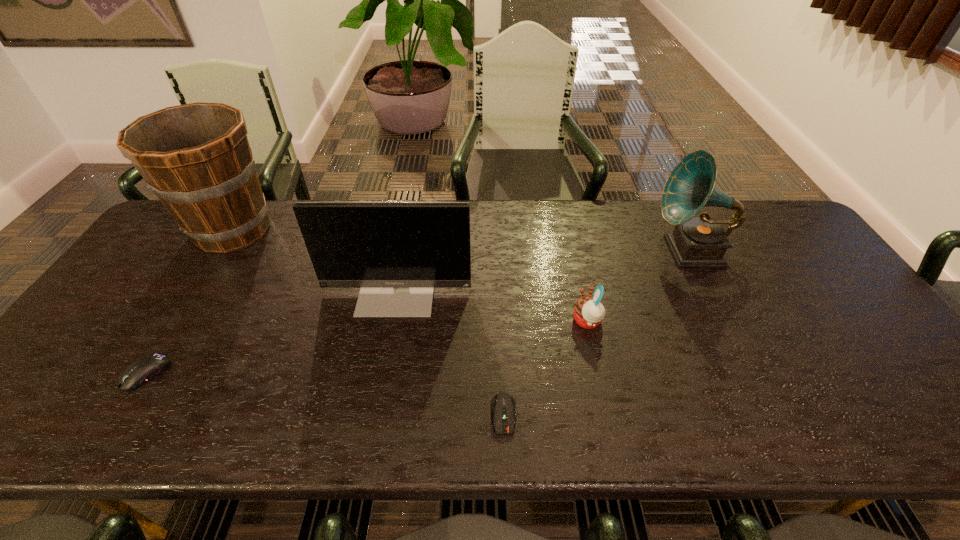
Identify the location of free space between the third object from left to right and the farther computer equipment. 272,332.

Where is `free space between the nearest object and the fifth object from left to right`? free space between the nearest object and the fifth object from left to right is located at coordinates (545, 368).

What are the coordinates of `vacant area that lies between the right computer equipment and the phonograph_record` in the screenshot? It's located at (597, 333).

Find the location of a particular element. This screenshot has height=540, width=960. vacant space in between the bucket and the fifth farthest object is located at coordinates (189, 301).

Identify the location of free space between the nearer computer equipment and the third object from left to right. (450, 352).

The width and height of the screenshot is (960, 540). I want to click on vacant point located between the rightmost object and the second object from right to left, so click(x=638, y=286).

The height and width of the screenshot is (540, 960). In order to click on the closest object relative to the left computer equipment in this screenshot , I will do `click(397, 252)`.

At what (x,y) coordinates should I click in order to perform the action: click on object that is the third closest to the rightmost object. Please return your answer as a coordinate pair (x, y). The height and width of the screenshot is (540, 960). Looking at the image, I should click on (503, 404).

Identify the location of vacant area in the image that satisfies the following two spatial constraints: 1. from the horn of the rightmost object; 2. on the button of the third object from right to left. The height and width of the screenshot is (540, 960). (772, 414).

This screenshot has height=540, width=960. What are the coordinates of `free space in the image that satisfies the following two spatial constraints: 1. on the front-facing side of the muffin; 2. on the button of the right computer equipment` in the screenshot? It's located at (608, 414).